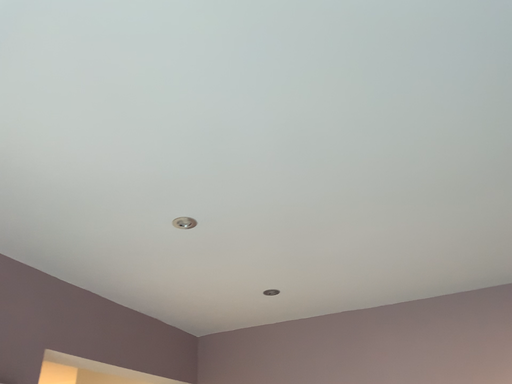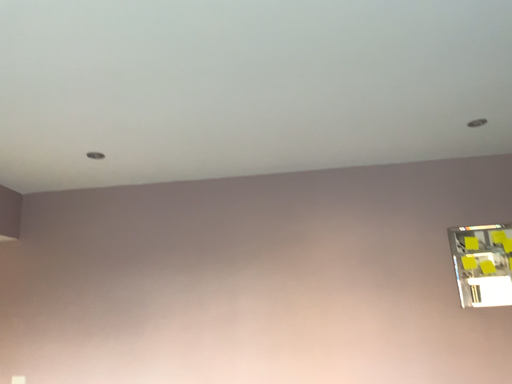
Question: Which way did the camera rotate in the video?

Choices:
 (A) rotated upward
 (B) rotated downward

Answer: (B)